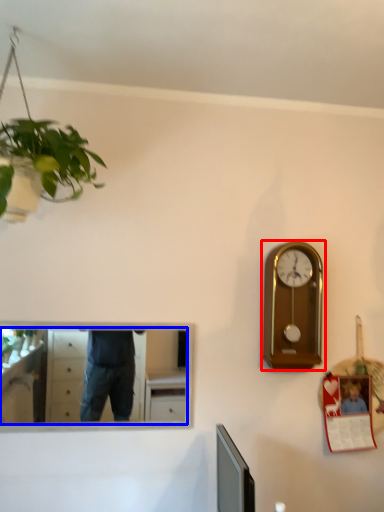
Question: Which object appears farthest to the camera in this image, wall clock (highlighted by a red box) or mirror (highlighted by a blue box)?

Choices:
 (A) wall clock
 (B) mirror

Answer: (A)